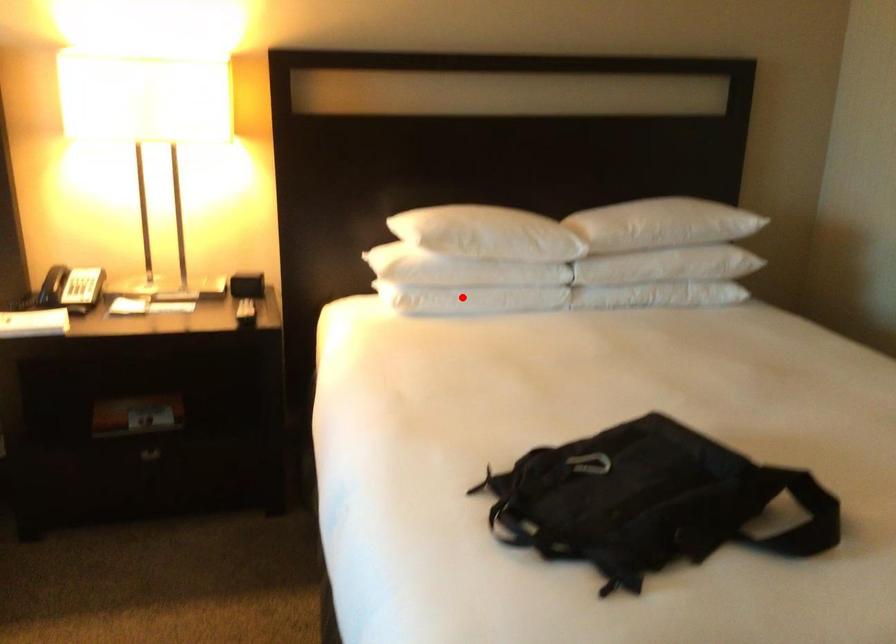
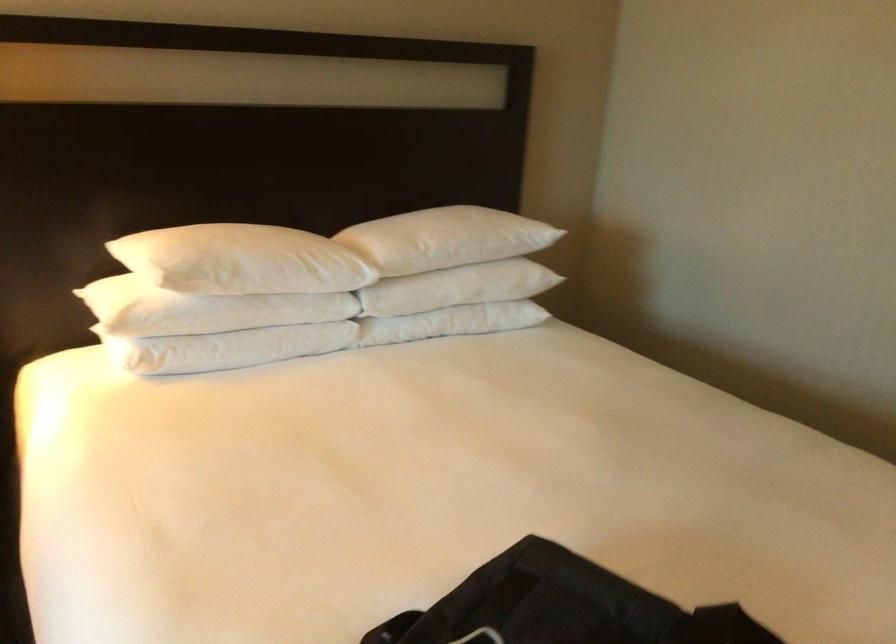
Where in the second image is the point corresponding to the highlighted location from the first image?

(226, 348)